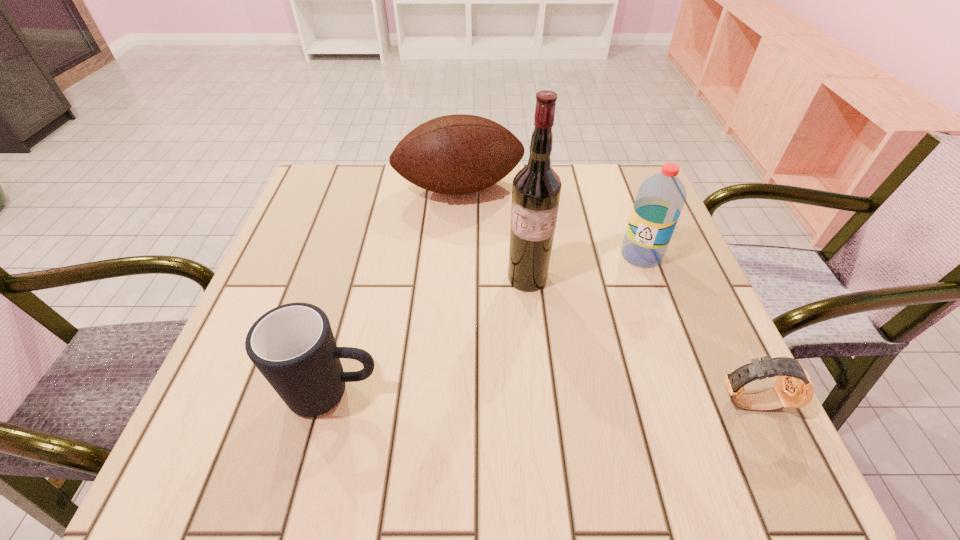
At what (x,y) coordinates should I click in order to perform the action: click on water bottle situated at the right edge. Please return your answer as a coordinate pair (x, y). This screenshot has height=540, width=960. Looking at the image, I should click on (660, 199).

The height and width of the screenshot is (540, 960). I want to click on object that is at the near left corner, so click(x=292, y=345).

At what (x,y) coordinates should I click in order to perform the action: click on object present at the near right corner. Please return your answer as a coordinate pair (x, y). This screenshot has height=540, width=960. Looking at the image, I should click on (794, 388).

Where is `free point at the far edge`? The image size is (960, 540). free point at the far edge is located at coordinates (490, 201).

In the image, there is a desktop. Where is `free space at the left edge`? The image size is (960, 540). free space at the left edge is located at coordinates (348, 222).

The image size is (960, 540). I want to click on vacant space at the right edge, so click(x=651, y=302).

The width and height of the screenshot is (960, 540). In the image, there is a desktop. Identify the location of free space at the far left corner. (343, 194).

This screenshot has width=960, height=540. In the image, there is a desktop. In order to click on vacant region at the far right corner in this screenshot , I will do `click(618, 195)`.

What are the coordinates of `vacant area between the second shortest object and the wine bottle` in the screenshot? It's located at (430, 335).

Locate an element on the screen. The height and width of the screenshot is (540, 960). free spot between the watch and the fourth tallest object is located at coordinates (540, 397).